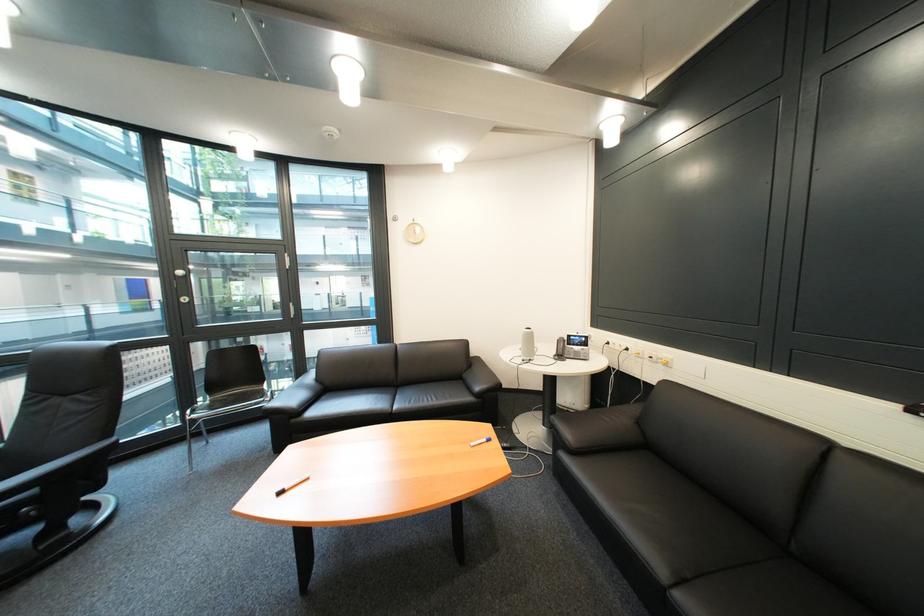
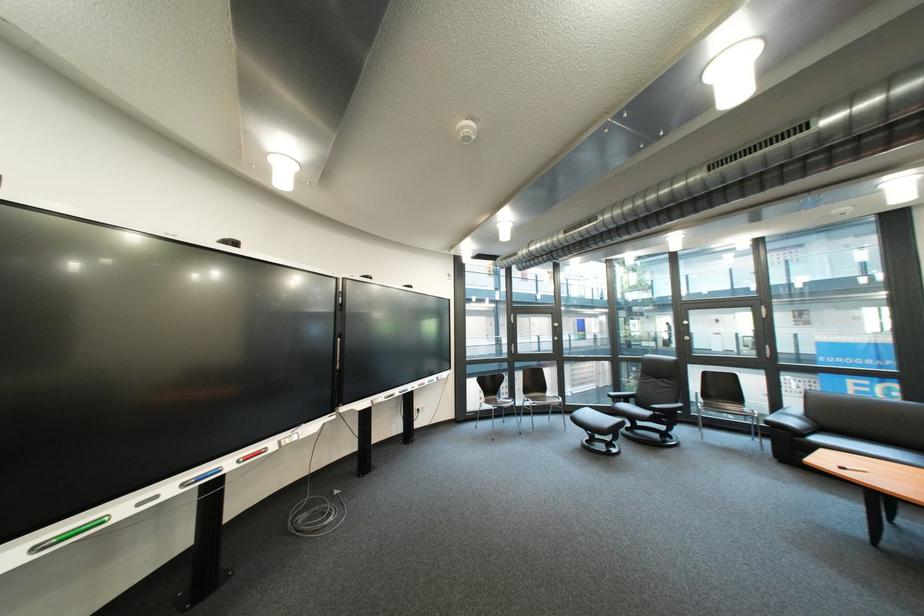
Find the pixel in the second image that matches pixel 331 381 in the first image.

(822, 418)